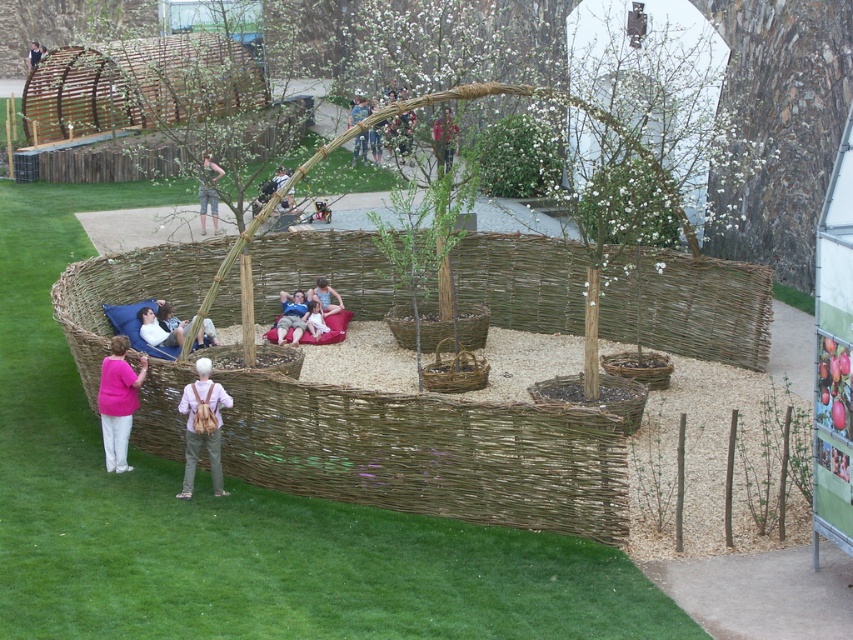
You are standing at the entrance of the outdoor seating area and notice a matte black jacket at upper center. If you walk straight ahead, will the jacket be in your path?

The matte black jacket at upper center is located at point (387, 134), which is to the upper center of the seating area. Since you are walking straight ahead from the entrance, the jacket is positioned to your upper center and not directly in your path.

You are standing in the outdoor seating area and notice two items of clothing. One is a matte black jacket at upper center and the other is a white cotton shirt at center. Which clothing item is nearer to you?

The matte black jacket at upper center is closer to the viewer than the white cotton shirt at center, so the matte black jacket at upper center is nearer to you.

You are sitting on the matte red beanbag at center and want to reach the white cotton shirt at center. In which direction should you move to grab it?

The white cotton shirt at center is positioned on the left side of the matte red beanbag at center, so you should move to your left to grab it.